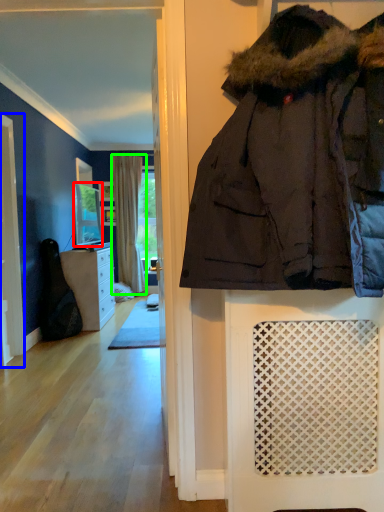
Question: Which object is positioned farthest from mirror (highlighted by a red box)? Select from screen door (highlighted by a blue box) and curtain (highlighted by a green box).

Choices:
 (A) screen door
 (B) curtain

Answer: (A)